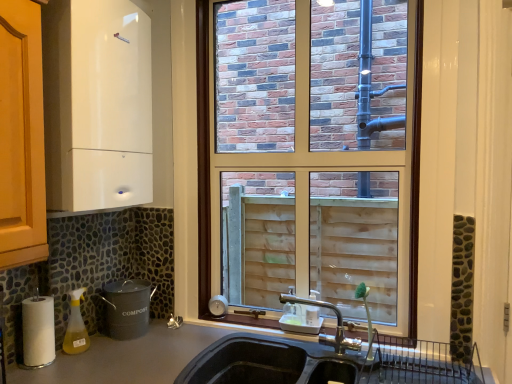
Find the location of a particular element. vacant space to the right of yellow translucent spray bottle at lower left is located at coordinates (121, 342).